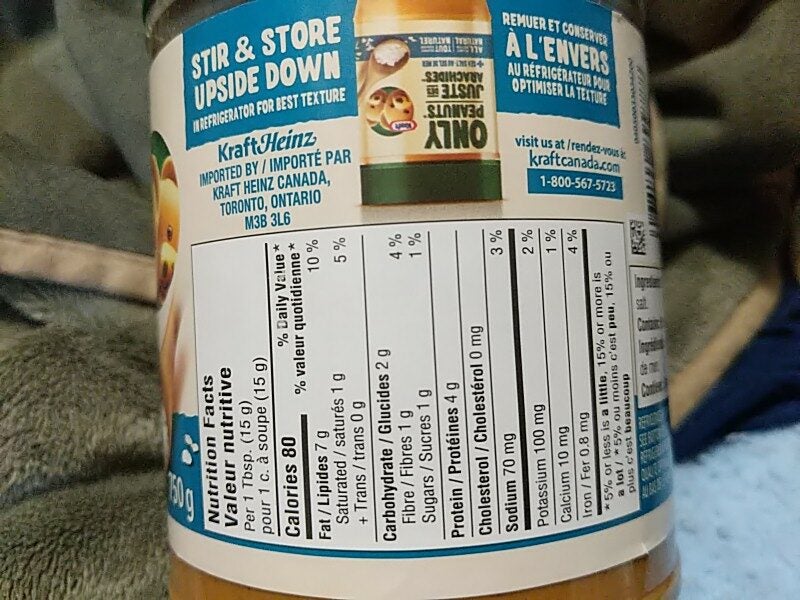
Where is `tan trim on blanket`? tan trim on blanket is located at coordinates (41, 260), (102, 280), (677, 405), (721, 343).